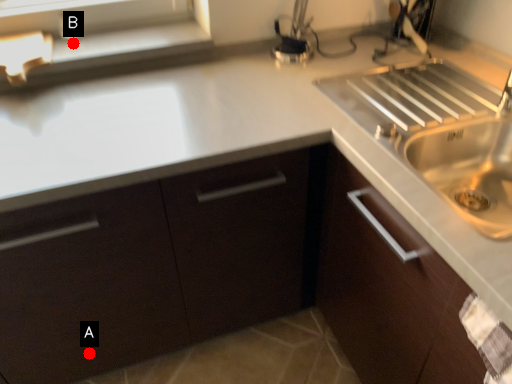
Question: Two points are circled on the image, labeled by A and B beside each circle. Which point is further to the camera?

Choices:
 (A) A is further
 (B) B is further

Answer: (B)